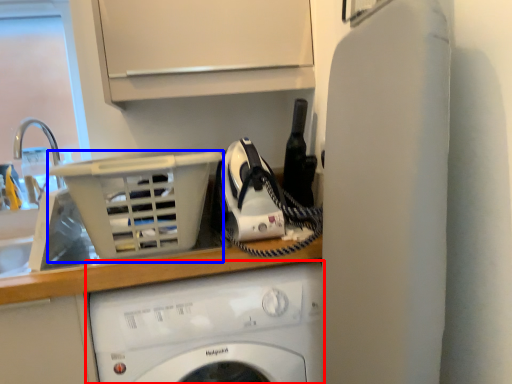
Question: Which point is closer to the camera, washing machine (highlighted by a red box) or basket (highlighted by a blue box)?

Choices:
 (A) washing machine
 (B) basket

Answer: (B)